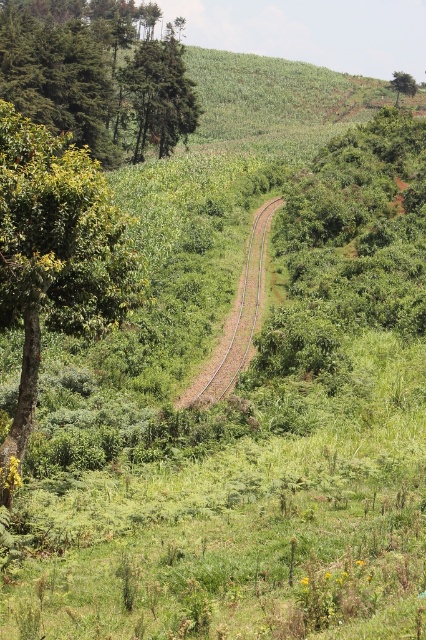
Question: Which point appears closest to the camera in this image?

Choices:
 (A) (406, 77)
 (B) (230, 328)
 (C) (74, 198)

Answer: (C)

Question: Among these objects, which one is farthest from the camera?

Choices:
 (A) brown metallic train track at center
 (B) green leafy tree at left
 (C) green matte tree at upper left

Answer: (C)

Question: Can you confirm if green leafy tree at left is positioned to the left of brown metallic train track at center?

Choices:
 (A) yes
 (B) no

Answer: (A)

Question: Does green leafy tree at left have a lesser width compared to brown metallic train track at center?

Choices:
 (A) no
 (B) yes

Answer: (B)

Question: Does green leafy tree at left lie behind green matte tree at upper left?

Choices:
 (A) no
 (B) yes

Answer: (A)

Question: Which object is farther from the camera taking this photo?

Choices:
 (A) green matte tree at upper left
 (B) green leafy tree at left

Answer: (A)